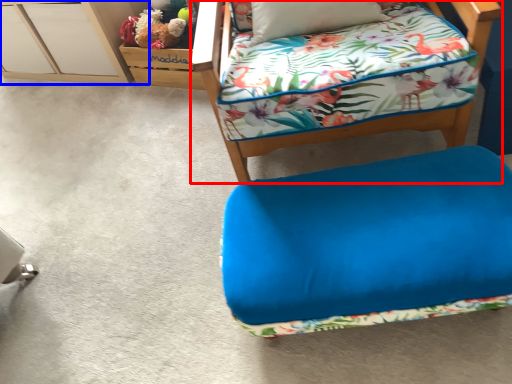
Question: Among these objects, which one is nearest to the camera, furniture (highlighted by a red box) or file cabinet (highlighted by a blue box)?

Choices:
 (A) furniture
 (B) file cabinet

Answer: (A)